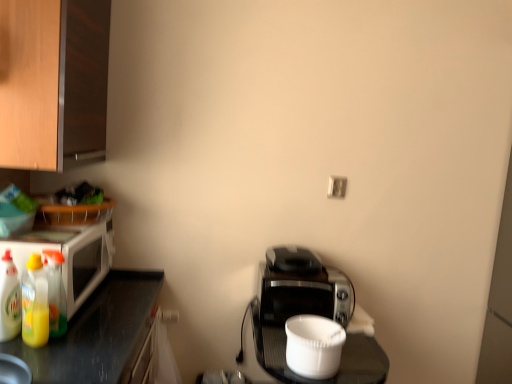
The image size is (512, 384). In order to click on vacant space situated above white glossy microwave at left (from a real-world perspective) in this screenshot , I will do `click(53, 231)`.